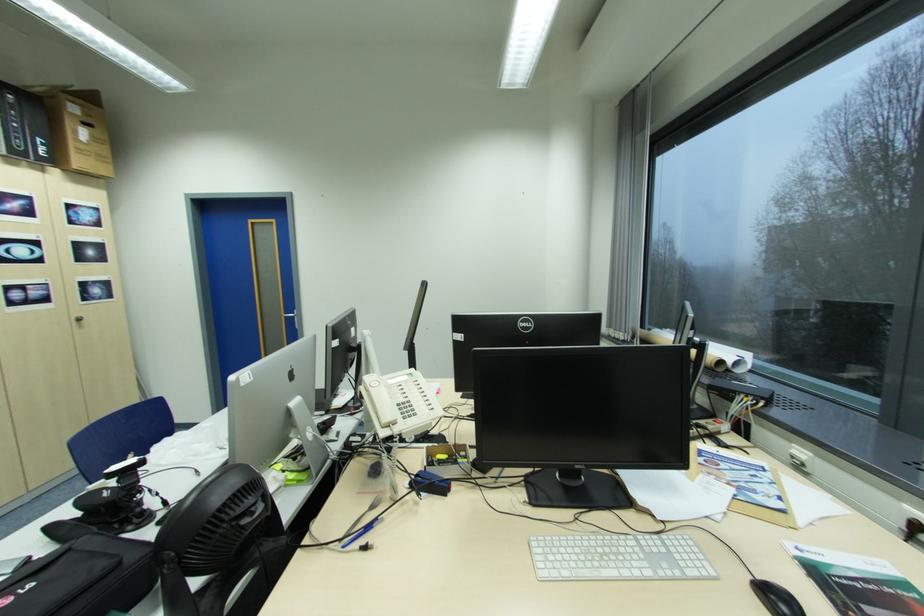
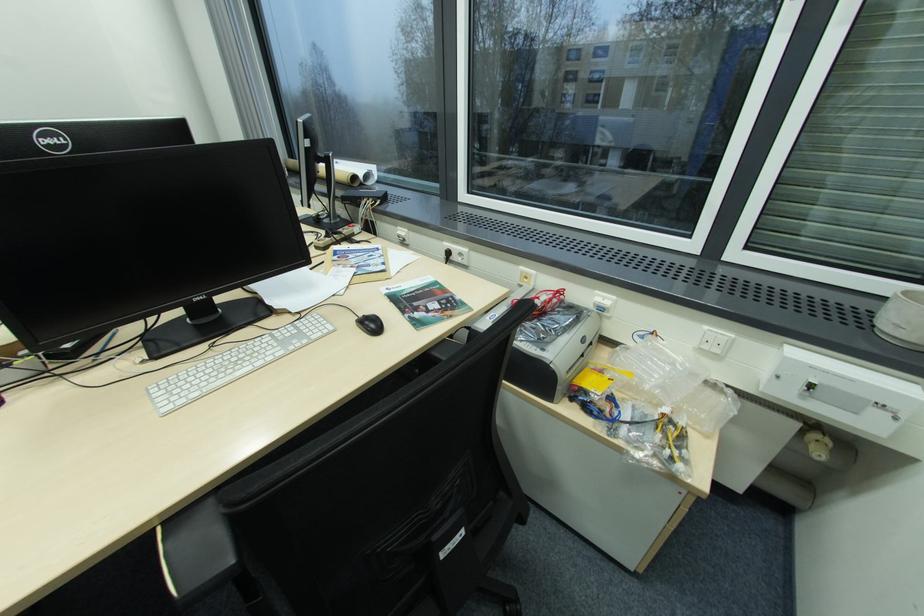
Locate, in the second image, the point that corresponds to [549,565] in the first image.

(172, 403)